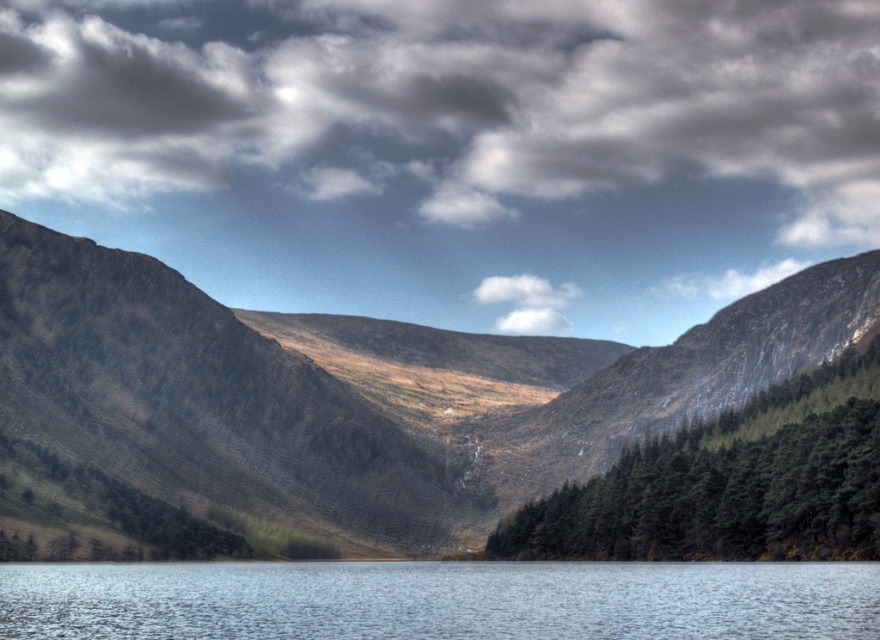
You are standing at the edge of the transparent water at center in the image. Looking towards the rugged stone mountain at center, which object is higher in elevation?

The rugged stone mountain at center is taller than the transparent water at center, so the rugged stone mountain at center is higher in elevation.